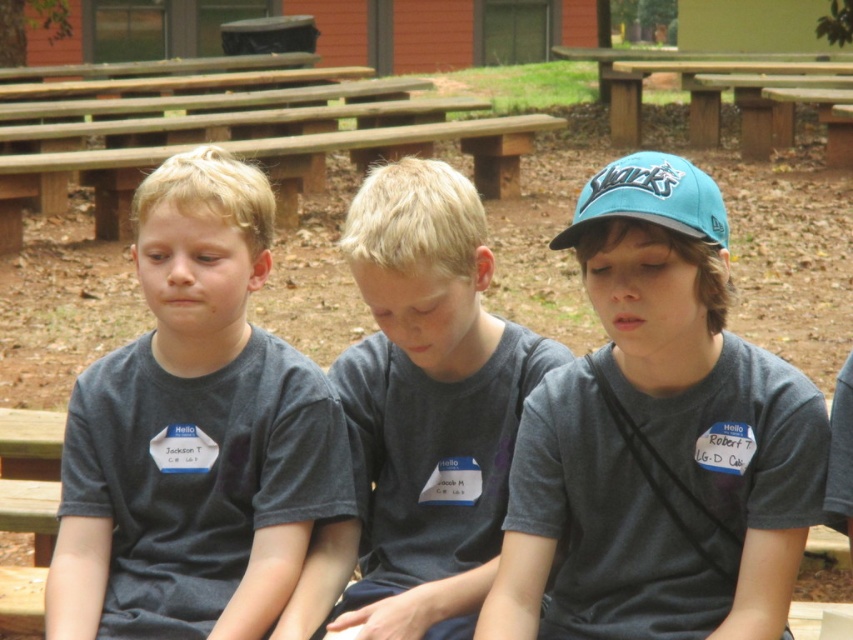
Which is behind, point (416, 132) or point (643, 198)?

Point (416, 132)

Which is below, wooden bench at center or teal fabric baseball cap at upper right?

teal fabric baseball cap at upper right is below.

Is point (519, 141) farther from camera compared to point (606, 211)?

Yes, it is behind point (606, 211).

Where is `wooden bench at center`? This screenshot has width=853, height=640. wooden bench at center is located at coordinates (410, 147).

Which is below, dark gray t-shirt at center or gray cotton shirt at center?

dark gray t-shirt at center

How much distance is there between dark gray t-shirt at center and gray cotton shirt at center?

dark gray t-shirt at center is 10.74 inches from gray cotton shirt at center.

Is point (125, 397) closer to camera compared to point (399, 408)?

Yes, it is in front of point (399, 408).

The width and height of the screenshot is (853, 640). Find the location of `dark gray t-shirt at center`. dark gray t-shirt at center is located at coordinates (194, 433).

Which is below, gray cotton shirt at center or wooden bench at center?

gray cotton shirt at center is lower down.

Does gray cotton shirt at center appear under wooden bench at center?

Yes.

You are a GUI agent. You are given a task and a screenshot of the screen. Output one action in this format:
    pyautogui.click(x=<x>, y=<y>)
    Task: Click on the gray cotton shirt at center
    The height and width of the screenshot is (640, 853).
    Given the screenshot: What is the action you would take?
    pyautogui.click(x=428, y=403)

The image size is (853, 640). I want to click on gray cotton shirt at center, so click(428, 403).